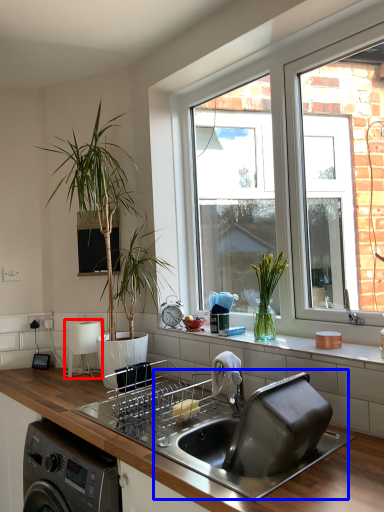
Question: Among these objects, which one is nearest to the camera, appliance (highlighted by a red box) or sink (highlighted by a blue box)?

Choices:
 (A) appliance
 (B) sink

Answer: (B)